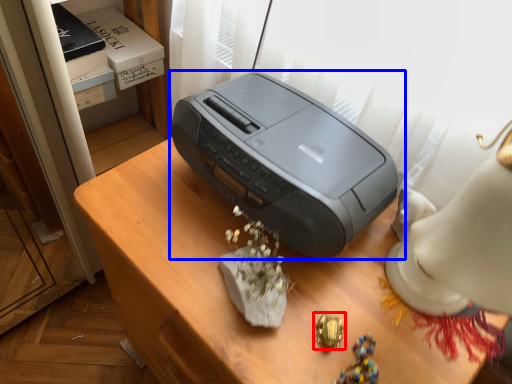
Question: Among these objects, which one is nearest to the camera, jewellery (highlighted by a red box) or printer (highlighted by a blue box)?

Choices:
 (A) jewellery
 (B) printer

Answer: (B)